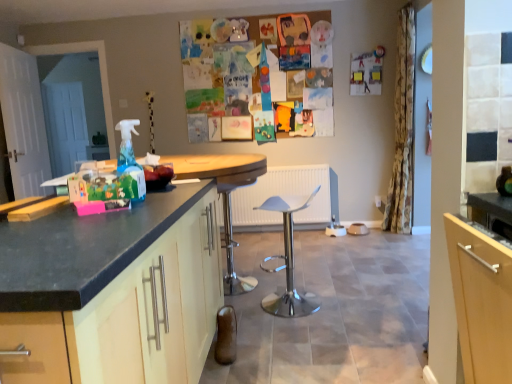
Question: From the image's perspective, is wooden round table at center above or below white plastic stool at center?

Choices:
 (A) below
 (B) above

Answer: (B)

Question: From a real-world perspective, relative to white plastic stool at center, is wooden round table at center vertically above or below?

Choices:
 (A) below
 (B) above

Answer: (B)

Question: Estimate the real-world distances between objects in this image. Which object is closer to the wooden round table at center?

Choices:
 (A) white wooden door at left
 (B) white plastic stool at center
 (C) floral fabric curtain at right
 (D) white glossy swivel chair at center
 (E) matte wood cabinet at left

Answer: (B)

Question: Which is nearer to the wooden round table at center?

Choices:
 (A) floral fabric curtain at right
 (B) white plastic stool at center
 (C) white wooden door at left
 (D) white glossy swivel chair at center
 (E) matte wood cabinet at left

Answer: (B)